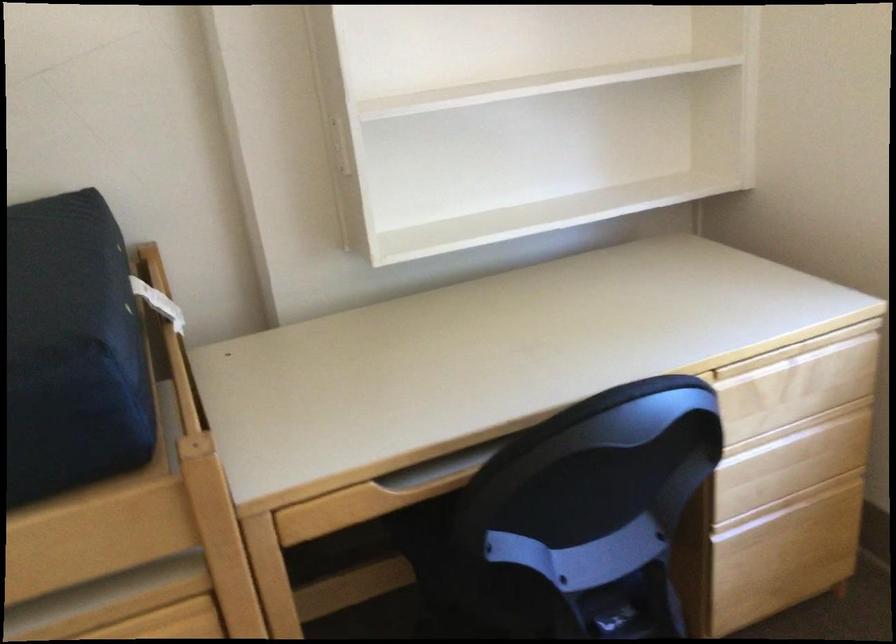
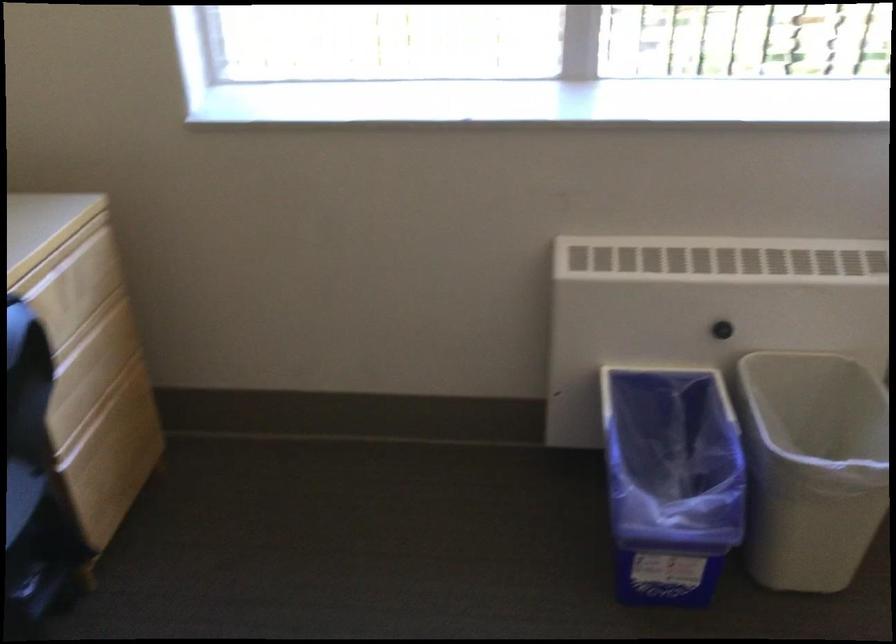
Question: The camera is either moving clockwise (left) or counter-clockwise (right) around the object. The first image is from the beginning of the video and the second image is from the end. Is the camera moving left or right when shooting the video?

Choices:
 (A) Left
 (B) Right

Answer: (A)